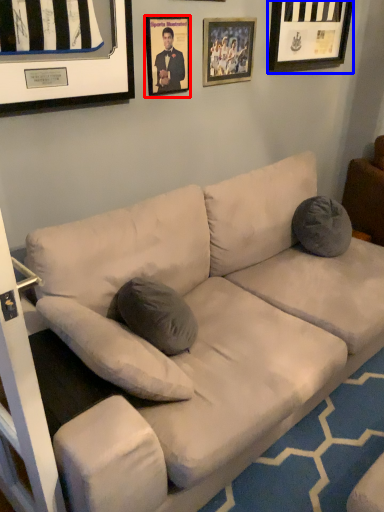
Question: Which object is further to the camera taking this photo, picture frame (highlighted by a red box) or picture frame (highlighted by a blue box)?

Choices:
 (A) picture frame
 (B) picture frame

Answer: (B)